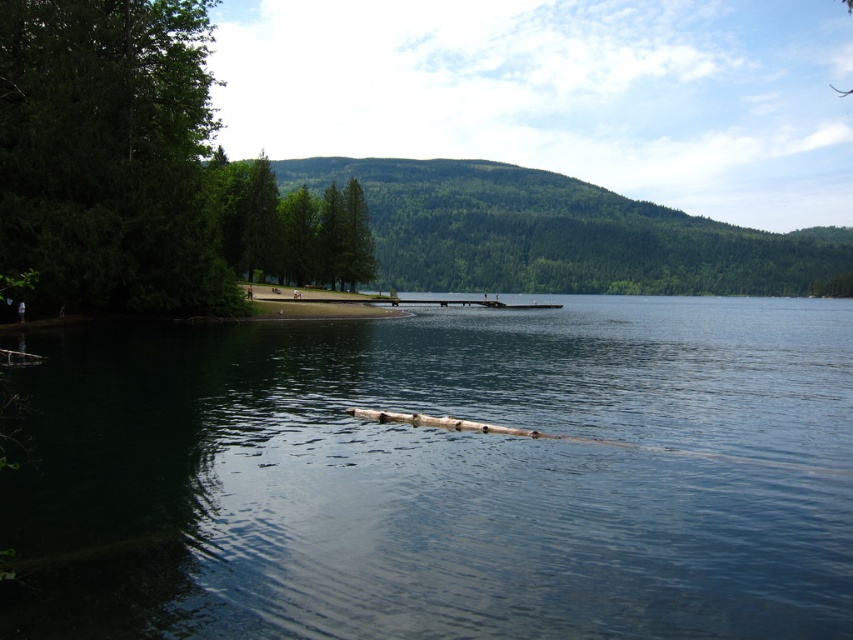
Is point (550, 344) closer to viewer compared to point (442, 189)?

Yes, it is in front of point (442, 189).

Between point (750, 464) and point (469, 248), which one is positioned behind?

Positioned behind is point (469, 248).

This screenshot has width=853, height=640. I want to click on clear water at center, so click(450, 476).

Is clear water at center thinner than green matte tree at center?

Incorrect, clear water at center's width is not less than green matte tree at center's.

Between point (795, 570) and point (300, 257), which one is positioned behind?

Point (300, 257)

Identify the location of clear water at center. (450, 476).

Is green matte tree at left taller than green matte tree at center?

Incorrect, green matte tree at left's height is not larger of green matte tree at center's.

Is green matte tree at left shorter than green matte tree at center?

Yes, green matte tree at left is shorter than green matte tree at center.

The width and height of the screenshot is (853, 640). What are the coordinates of `green matte tree at left` in the screenshot? It's located at (109, 156).

Find the location of `green matte tree at left`. green matte tree at left is located at coordinates (109, 156).